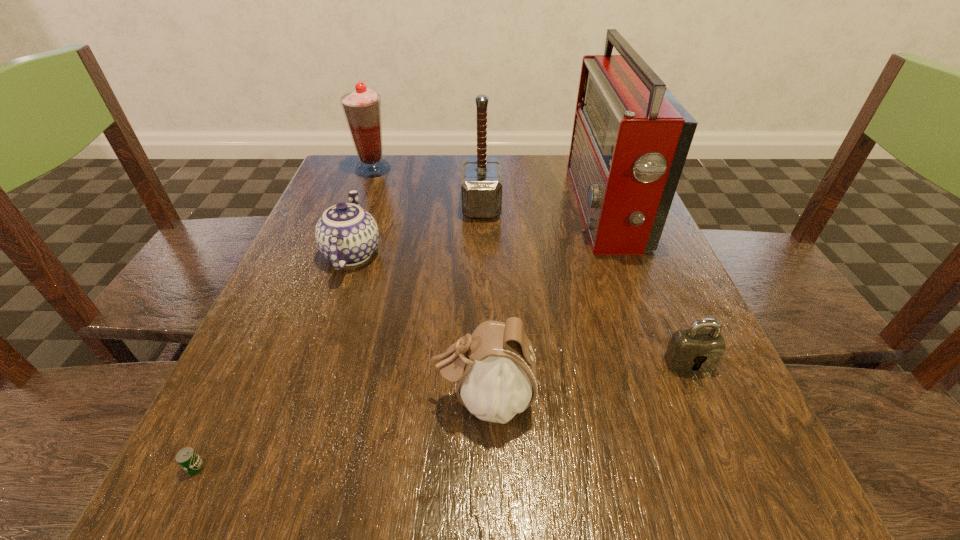
Image resolution: width=960 pixels, height=540 pixels. Find the location of `object present at the far left corner`. object present at the far left corner is located at coordinates (362, 108).

Locate an element on the screen. The height and width of the screenshot is (540, 960). object situated at the near left corner is located at coordinates (187, 458).

Locate an element on the screen. object that is at the far right corner is located at coordinates click(631, 137).

Locate an element on the screen. The width and height of the screenshot is (960, 540). vacant space at the far edge of the desktop is located at coordinates (536, 192).

In the image, there is a desktop. Identify the location of vacant space at the near edge. The height and width of the screenshot is (540, 960). (425, 506).

In the image, there is a desktop. At what (x,y) coordinates should I click in order to perform the action: click on free space at the left edge. Please return your answer as a coordinate pair (x, y). The width and height of the screenshot is (960, 540). Looking at the image, I should click on (318, 211).

Locate an element on the screen. Image resolution: width=960 pixels, height=540 pixels. blank area at the right edge is located at coordinates (705, 389).

Identify the location of vacant space at the far left corner of the desktop. The width and height of the screenshot is (960, 540). (388, 182).

In the image, there is a desktop. Identify the location of free space at the near left corner. point(268,460).

Where is `empty space that is in between the hammer and the tallest object`? empty space that is in between the hammer and the tallest object is located at coordinates (543, 207).